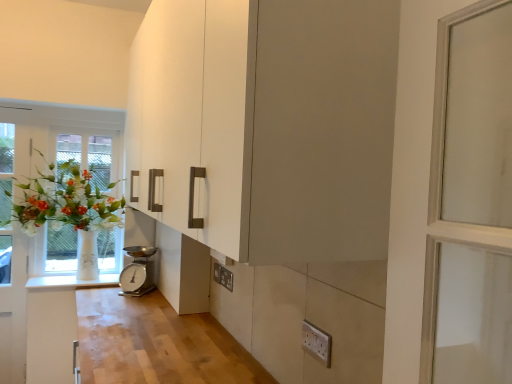
Looking at this image, in order to face white glass vase at left, should I rotate leftwards or rightwards?

You should look left and rotate roughly 24.865 degrees.

The image size is (512, 384). In order to click on white glass vase at left in this screenshot , I will do `click(72, 200)`.

Identify the location of white glossy counter top at lower left. The height and width of the screenshot is (384, 512). (72, 282).

Consider the image. From a real-world perspective, is white glossy counter top at lower left physically below white glass vase at left?

Yes, from a real-world perspective, white glossy counter top at lower left is beneath white glass vase at left.

Is white glossy counter top at lower left positioned before white glass vase at left?

No, white glossy counter top at lower left is behind white glass vase at left.

Considering the relative sizes of white glossy counter top at lower left and white glass vase at left in the image provided, is white glossy counter top at lower left thinner than white glass vase at left?

Indeed, white glossy counter top at lower left has a lesser width compared to white glass vase at left.

Considering the sizes of white glossy counter top at lower left and white glass vase at left in the image, is white glossy counter top at lower left taller or shorter than white glass vase at left?

white glossy counter top at lower left is shorter than white glass vase at left.

From a real-world perspective, is matte white cabinet at lower center located beneath white glass vase at left?

Yes, from a real-world perspective, matte white cabinet at lower center is below white glass vase at left.

Between matte white cabinet at lower center and white glass vase at left, which one is positioned in front?

Positioned in front is matte white cabinet at lower center.

Would you say matte white cabinet at lower center contains white glass vase at left?

No, matte white cabinet at lower center does not contain white glass vase at left.

Is matte white cabinet at lower center at the left side of white glass vase at left?

No.

Between point (227, 289) and point (60, 279), which one is positioned behind?

The point (60, 279) is more distant.

From the picture: Between white plastic electric outlet at lower center, positioned as the first electric outlet in left-to-right order, and white glossy counter top at lower left, which one has larger size?

Bigger between the two is white glossy counter top at lower left.

Is white plastic electric outlet at lower center, the 2th electric outlet viewed from the front, next to white glossy counter top at lower left and touching it?

No, white plastic electric outlet at lower center, the 2th electric outlet viewed from the front, is not in contact with white glossy counter top at lower left.

What are the coordinates of `counter top below the white plastic electric outlet at lower center, which is the second electric outlet from right to left (from the image's perspective)` in the screenshot? It's located at (72, 282).

Is white plastic electric outlet at lower right, which is the second electric outlet in left-to-right order, turned away from white glossy counter top at lower left?

No, white glossy counter top at lower left is not at the back of white plastic electric outlet at lower right, which is the second electric outlet in left-to-right order.

Locate an element on the screen. The image size is (512, 384). counter top that is behind the white plastic electric outlet at lower right, which is the first electric outlet from front to back is located at coordinates (72, 282).

Is white plastic electric outlet at lower right, which is the second electric outlet in left-to-right order, inside or outside of white glossy counter top at lower left?

white plastic electric outlet at lower right, which is the second electric outlet in left-to-right order, exists outside the volume of white glossy counter top at lower left.

Does white plastic electric outlet at lower center, which is the second electric outlet from right to left, touch white glass vase at left?

Answer: white plastic electric outlet at lower center, which is the second electric outlet from right to left, and white glass vase at left are clearly separated.

Considering the sizes of objects white plastic electric outlet at lower center, the first electric outlet when ordered from back to front, and white glass vase at left in the image provided, who is taller, white plastic electric outlet at lower center, the first electric outlet when ordered from back to front, or white glass vase at left?

white glass vase at left.

Considering the positions of points (226, 283) and (31, 231), is point (226, 283) closer to camera compared to point (31, 231)?

Yes, it is.

Could you tell me if white plastic electric outlet at lower center, the 2th electric outlet viewed from the front, is facing white glass vase at left?

No, white plastic electric outlet at lower center, the 2th electric outlet viewed from the front, is not oriented towards white glass vase at left.

Can you tell me how much silver metallic scale at lower center and white glass vase at left differ in facing direction?

The facing directions of silver metallic scale at lower center and white glass vase at left are 35.7 degrees apart.

Identify the location of window above the silver metallic scale at lower center (from the image's perspective). (72, 200).

Which of these two, silver metallic scale at lower center or white glass vase at left, is bigger?

white glass vase at left is bigger.

Considering the points (134, 289) and (38, 173), which point is in front, point (134, 289) or point (38, 173)?

Positioned in front is point (134, 289).

Which is behind, point (153, 262) or point (196, 272)?

The point (153, 262) is behind.

Looking at the image, does silver metallic scale at lower center seem bigger or smaller compared to matte white cabinet at lower center?

silver metallic scale at lower center is smaller than matte white cabinet at lower center.

How different are the orientations of silver metallic scale at lower center and matte white cabinet at lower center in degrees?

silver metallic scale at lower center and matte white cabinet at lower center are facing 53.4 degrees away from each other.

Which object is further away from the camera, silver metallic scale at lower center or matte white cabinet at lower center?

silver metallic scale at lower center is further from the camera.

Find the location of `window lying in front of the white glossy counter top at lower left`. window lying in front of the white glossy counter top at lower left is located at coordinates (72, 200).

At what (x,y) coordinates should I click in order to perform the action: click on window behind the matte white cabinet at lower center. Please return your answer as a coordinate pair (x, y). Looking at the image, I should click on (72, 200).

Estimate the real-world distances between objects in this image. Which object is further from white plastic electric outlet at lower center, positioned as the first electric outlet in left-to-right order, white glass vase at left or white glossy counter top at lower left?

Based on the image, white glass vase at left appears to be further to white plastic electric outlet at lower center, positioned as the first electric outlet in left-to-right order.

Based on their spatial positions, is white plastic electric outlet at lower center, the first electric outlet when ordered from back to front, or matte white cabinet at lower center closer to white plastic electric outlet at lower right, marked as the first electric outlet in a right-to-left arrangement?

white plastic electric outlet at lower center, the first electric outlet when ordered from back to front, is positioned closer to the anchor white plastic electric outlet at lower right, marked as the first electric outlet in a right-to-left arrangement.

Estimate the real-world distances between objects in this image. Which object is further from silver metallic scale at lower center, white glass vase at left or matte white cabinet at lower center?

Based on the image, white glass vase at left appears to be further to silver metallic scale at lower center.

Based on their spatial positions, is white glass vase at left or white plastic electric outlet at lower right, which is the 2th electric outlet from back to front, closer to white glossy counter top at lower left?

white glass vase at left is positioned closer to the anchor white glossy counter top at lower left.

Looking at the image, which one is located closer to white plastic electric outlet at lower center, positioned as the first electric outlet in left-to-right order, matte white cabinet at lower center or white glass vase at left?

matte white cabinet at lower center lies closer to white plastic electric outlet at lower center, positioned as the first electric outlet in left-to-right order, than the other object.

From the image, which object appears to be nearer to white plastic electric outlet at lower right, marked as the first electric outlet in a right-to-left arrangement, white plastic electric outlet at lower center, the 2th electric outlet viewed from the front, or silver metallic scale at lower center?

white plastic electric outlet at lower center, the 2th electric outlet viewed from the front.

When comparing their distances from white plastic electric outlet at lower right, which is the 2th electric outlet from back to front, does white glass vase at left or white plastic electric outlet at lower center, positioned as the first electric outlet in left-to-right order, seem further?

Based on the image, white glass vase at left appears to be further to white plastic electric outlet at lower right, which is the 2th electric outlet from back to front.

Looking at the image, which one is located closer to matte white cabinet at lower center, white plastic electric outlet at lower center, positioned as the first electric outlet in left-to-right order, or white plastic electric outlet at lower right, which is the second electric outlet in left-to-right order?

white plastic electric outlet at lower center, positioned as the first electric outlet in left-to-right order, is closer to matte white cabinet at lower center.

Locate an element on the screen. The image size is (512, 384). electric outlet situated between white glass vase at left and white plastic electric outlet at lower right, which is the first electric outlet from front to back, from left to right is located at coordinates (223, 276).

Identify the location of counter top located between white glass vase at left and white plastic electric outlet at lower right, which is the second electric outlet in left-to-right order, in the left-right direction. (72, 282).

Where is `counter top between white glass vase at left and matte white cabinet at lower center from left to right`? The image size is (512, 384). counter top between white glass vase at left and matte white cabinet at lower center from left to right is located at coordinates (72, 282).

The width and height of the screenshot is (512, 384). Identify the location of cabinetry situated between white glass vase at left and white plastic electric outlet at lower right, marked as the first electric outlet in a right-to-left arrangement, from left to right. (182, 270).